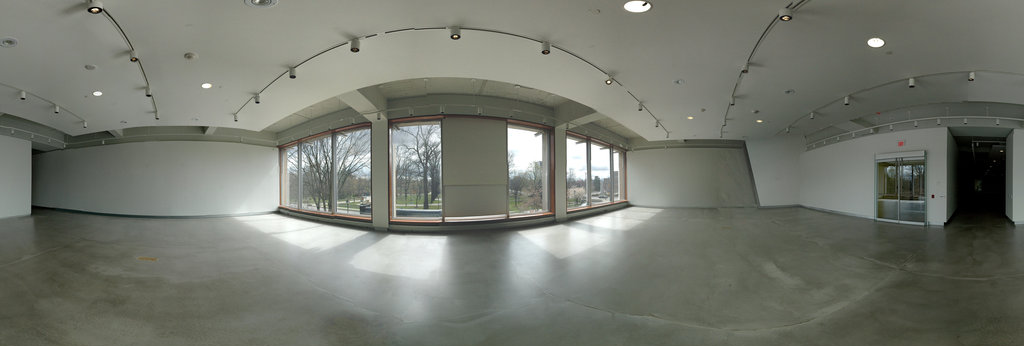
Image resolution: width=1024 pixels, height=346 pixels. I want to click on floor in front of right wall, so click(x=690, y=222).